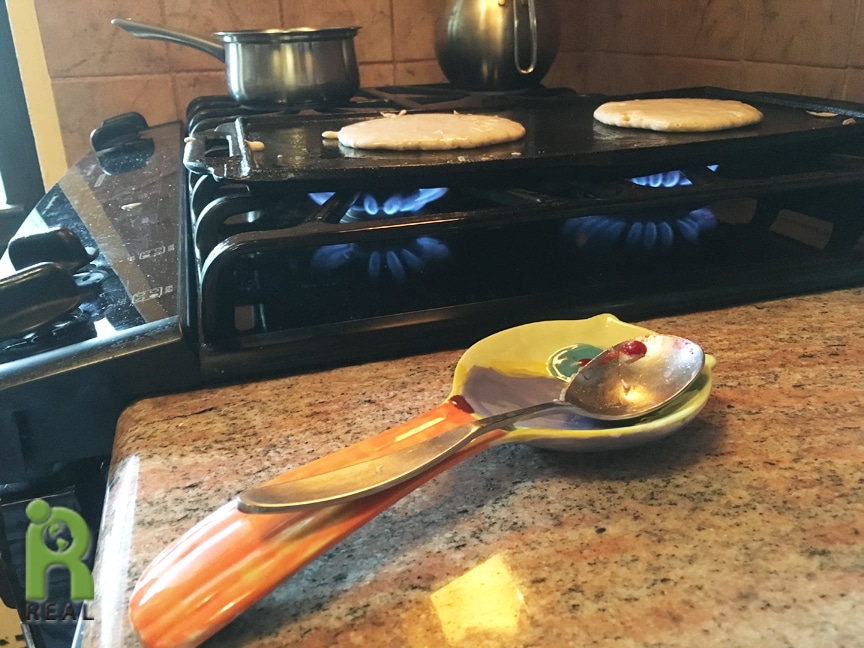
You are a GUI agent. You are given a task and a screenshot of the screen. Output one action in this format:
    pyautogui.click(x=<x>, y=<y>)
    Task: Click on the granite counter
    The image size is (864, 648).
    Given the screenshot: What is the action you would take?
    pyautogui.click(x=708, y=537)